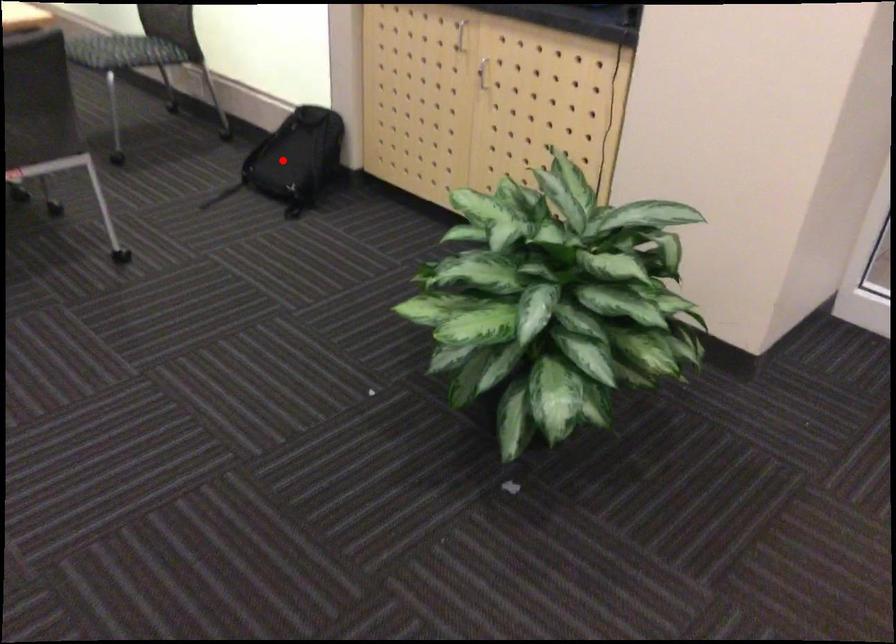
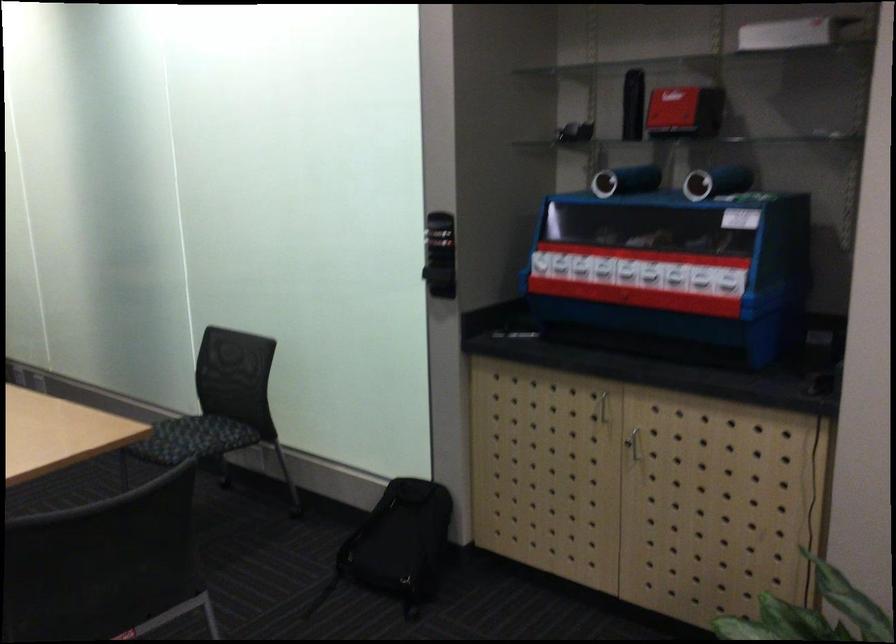
Where in the second image is the point corresponding to the highlighted location from the first image?

(398, 545)